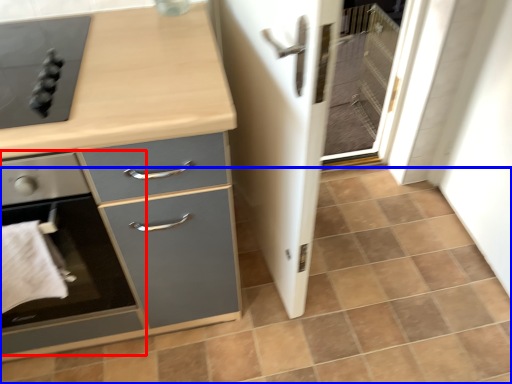
Question: Among these objects, which one is nearest to the camera, home appliance (highlighted by a red box) or tile (highlighted by a blue box)?

Choices:
 (A) home appliance
 (B) tile

Answer: (A)